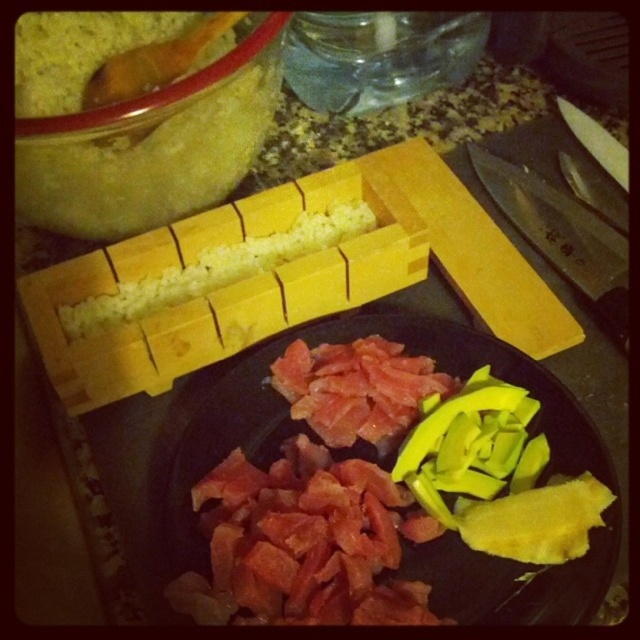
Does pinkish-red raw fish at center appear on the right side of yellow rice at center?

Yes, pinkish-red raw fish at center is to the right of yellow rice at center.

Between pinkish-red raw fish at center and yellow rice at center, which one has more height?

pinkish-red raw fish at center

Between point (604, 528) and point (289, 248), which one is positioned behind?

The point (289, 248) is more distant.

Where is `pinkish-red raw fish at center`? This screenshot has width=640, height=640. pinkish-red raw fish at center is located at coordinates (310, 433).

Can you confirm if pinkish-red raw fish at center is smaller than yellow smooth avocado at lower right?

Actually, pinkish-red raw fish at center might be larger than yellow smooth avocado at lower right.

Does pinkish-red raw fish at center come behind yellow smooth avocado at lower right?

No, it is not.

Does point (576, 593) lie behind point (540, 522)?

No, it is not.

The height and width of the screenshot is (640, 640). Identify the location of pinkish-red raw fish at center. (310, 433).

Between yellow smooth avocado at lower right and yellow rice at center, which one is positioned lower?

yellow smooth avocado at lower right is lower down.

Does point (481, 468) come behind point (230, 259)?

No, (481, 468) is closer to viewer.

Between point (461, 387) and point (339, 214), which one is positioned behind?

Positioned behind is point (339, 214).

You are a GUI agent. You are given a task and a screenshot of the screen. Output one action in this format:
    pyautogui.click(x=<x>, y=<y>)
    Task: Click on the yellow smooth avocado at lower right
    This screenshot has width=640, height=640.
    Given the screenshot: What is the action you would take?
    pyautogui.click(x=497, y=476)